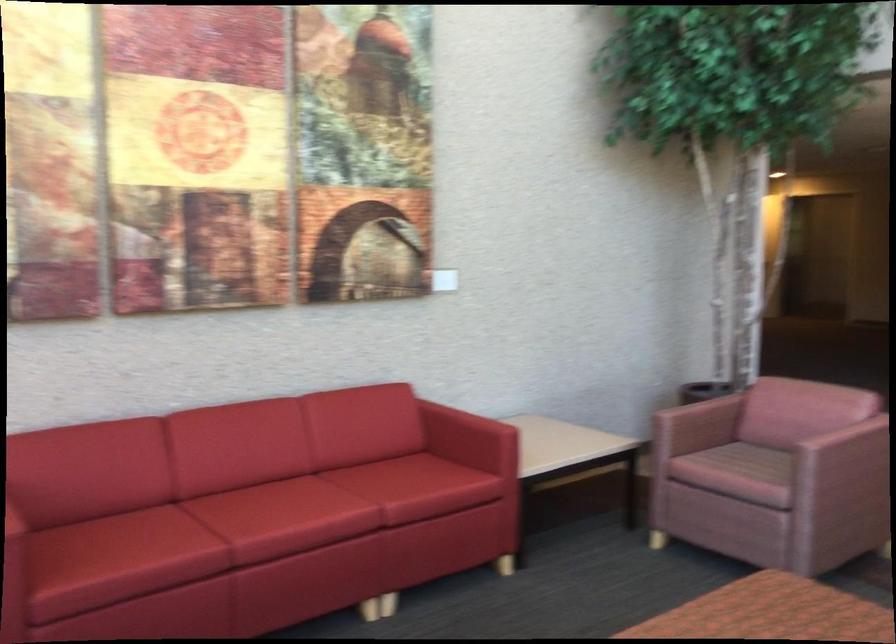
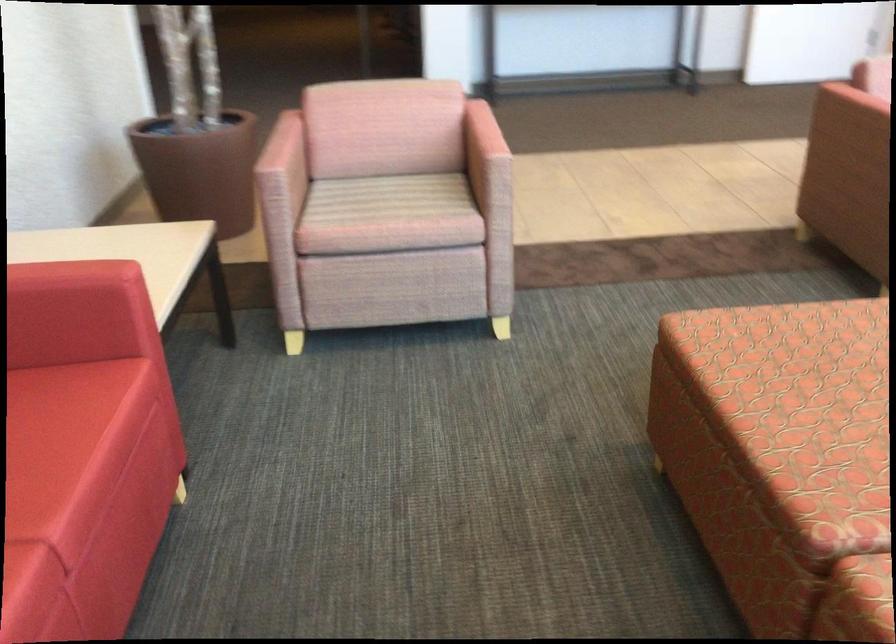
Find the pixel in the second image that matches pixel 754 458 in the first image.

(389, 198)